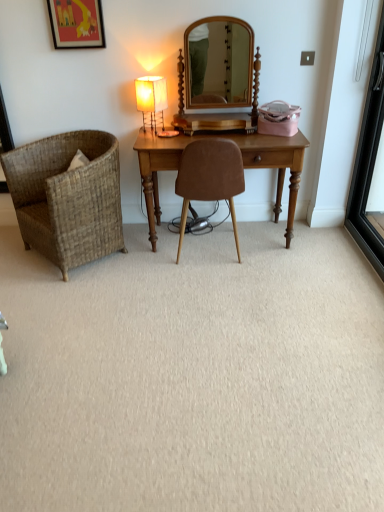
Find the location of `vacant space that is in between brown suede chair at center, marked as the first chair in a right-to-left arrangement, and wooden desk at center`. vacant space that is in between brown suede chair at center, marked as the first chair in a right-to-left arrangement, and wooden desk at center is located at coordinates (250, 251).